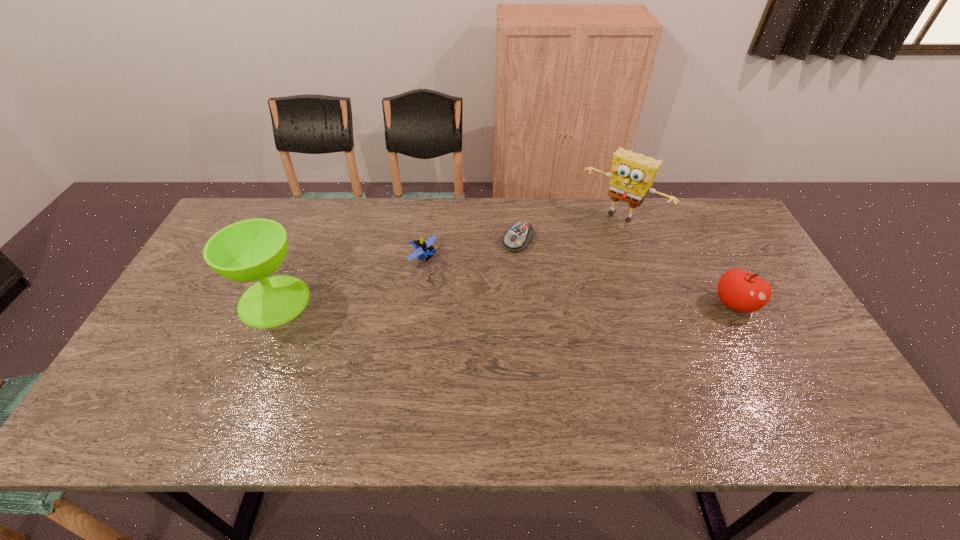
Find the location of a particular element. sponge that is at the far edge is located at coordinates (632, 174).

Where is `computer mouse at the far edge`? The height and width of the screenshot is (540, 960). computer mouse at the far edge is located at coordinates (517, 238).

Identify the location of object that is positioned at the right edge. This screenshot has height=540, width=960. (739, 290).

I want to click on free region at the far edge, so click(x=627, y=227).

Locate an element on the screen. Image resolution: width=960 pixels, height=540 pixels. vacant space at the near edge of the desktop is located at coordinates (302, 365).

What are the coordinates of `vacant space at the left edge` in the screenshot? It's located at click(x=191, y=303).

The width and height of the screenshot is (960, 540). I want to click on vacant region at the right edge of the desktop, so click(x=764, y=312).

Find the location of a particular element. The height and width of the screenshot is (540, 960). vacant region at the far left corner of the desktop is located at coordinates (238, 206).

In the image, there is a desktop. Identify the location of blank space at the far right corner. (708, 211).

Where is `vacant space that's between the Lego and the third tallest object`? The height and width of the screenshot is (540, 960). vacant space that's between the Lego and the third tallest object is located at coordinates (579, 280).